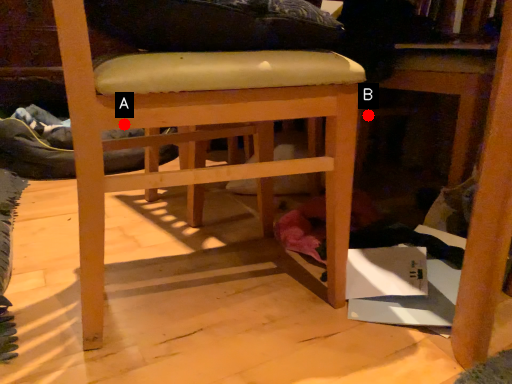
Question: Two points are circled on the image, labeled by A and B beside each circle. Among these points, which one is farthest from the camera?

Choices:
 (A) A is further
 (B) B is further

Answer: (B)